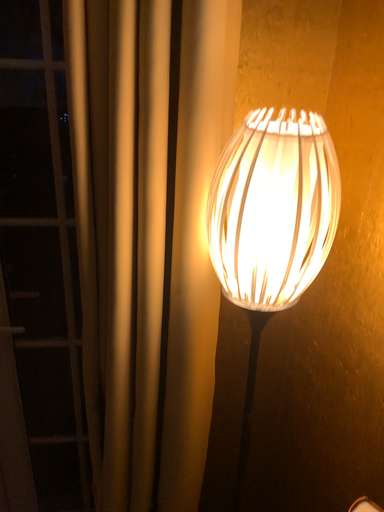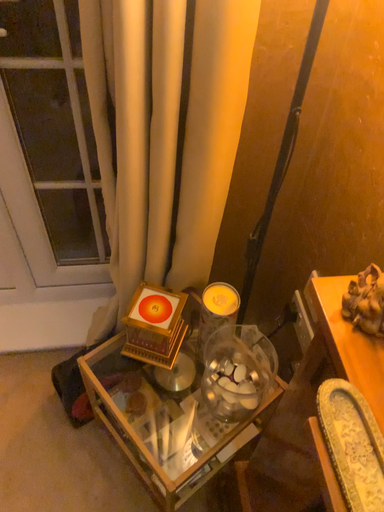
Question: Which way did the camera rotate in the video?

Choices:
 (A) rotated downward
 (B) rotated upward

Answer: (A)